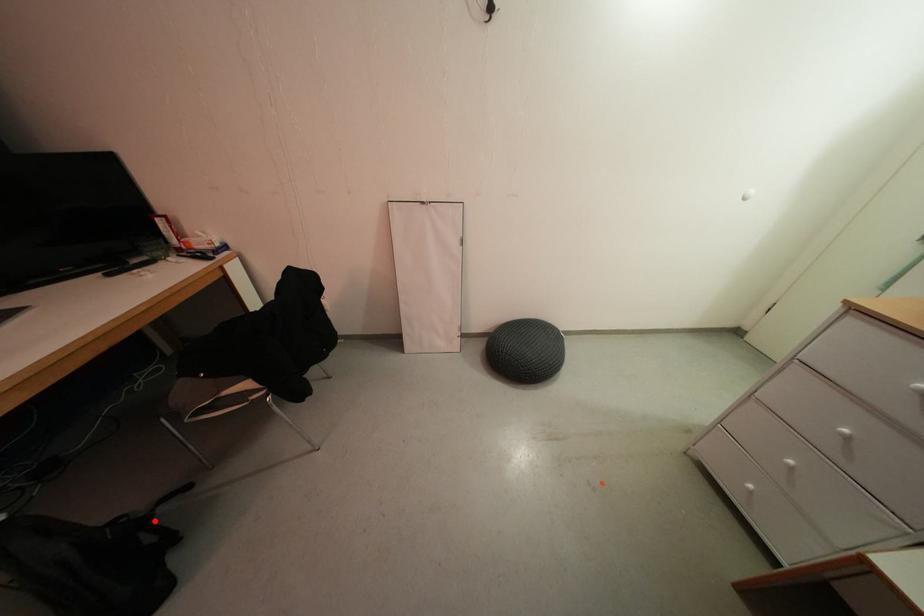
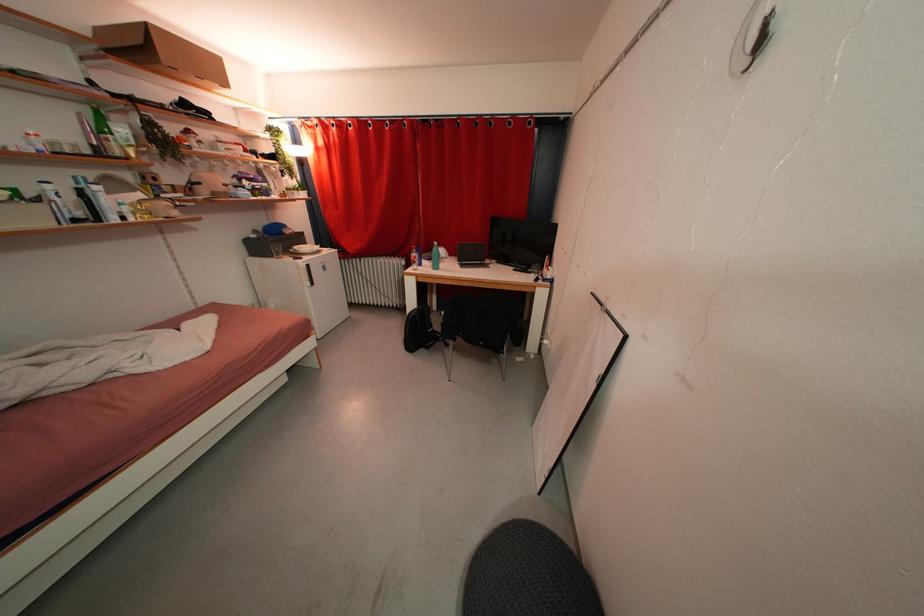
The point at the highlighted location is marked in the first image. Where is the corresponding point in the second image?

(444, 344)